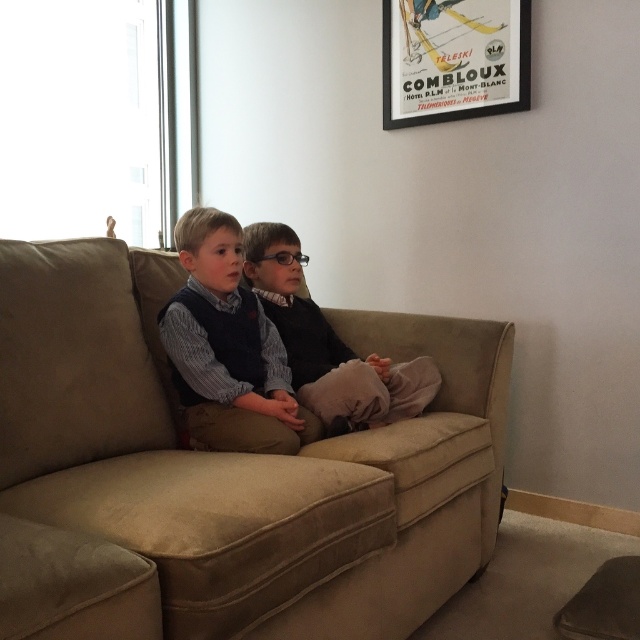
You are a furniture designer who wants to place a small table between the beige fabric couch at center and the matte black sweater at center. Considering their heights, which object should the table be placed closer to in order to ensure stability?

The beige fabric couch at center has a greater height compared to the matte black sweater at center, so the table should be placed closer to the beige fabric couch at center to ensure stability since it provides a more stable base.